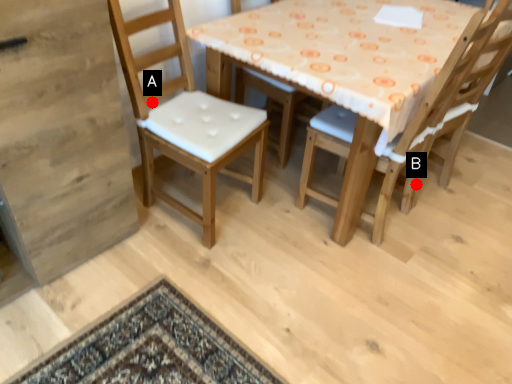
Question: Two points are circled on the image, labeled by A and B beside each circle. Which point is farther to the camera?

Choices:
 (A) A is further
 (B) B is further

Answer: (B)